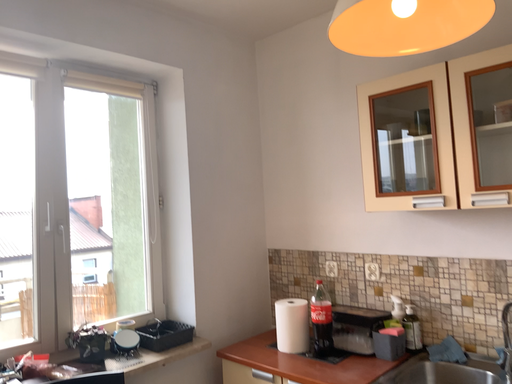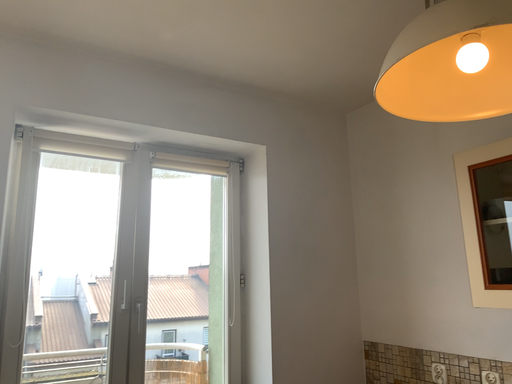
Question: Which way did the camera rotate in the video?

Choices:
 (A) rotated right
 (B) rotated left

Answer: (B)